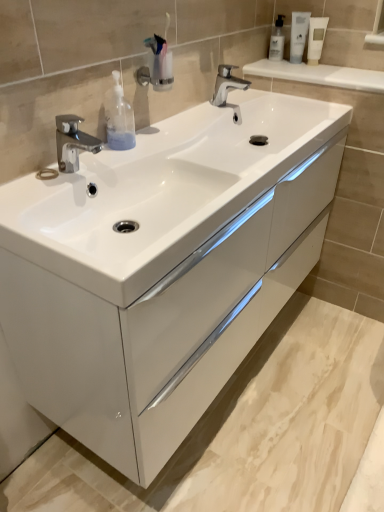
Find the location of a particular element. Image resolution: width=384 pixels, height=512 pixels. free space to the right of transparent plastic bottle at left is located at coordinates (175, 142).